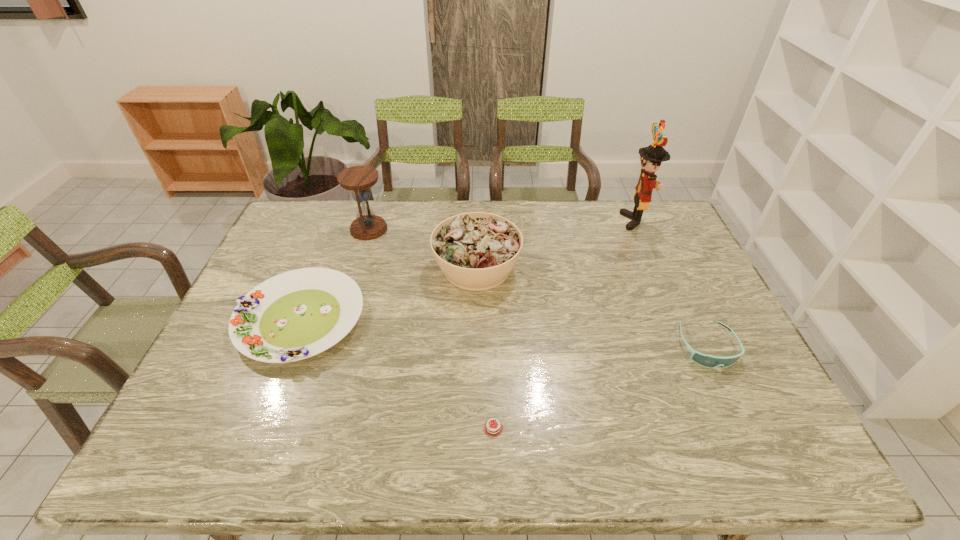
What are the coordinates of `nutcracker` in the screenshot? It's located at (651, 157).

You are a GUI agent. You are given a task and a screenshot of the screen. Output one action in this format:
    pyautogui.click(x=<x>, y=<y>)
    Task: Click on the fifth shortest object
    This screenshot has height=540, width=960.
    Given the screenshot: What is the action you would take?
    pyautogui.click(x=367, y=226)

The image size is (960, 540). I want to click on the fourth shortest object, so click(476, 251).

Identify the location of salad plate. (295, 315).

Where is `goggles`? The width and height of the screenshot is (960, 540). goggles is located at coordinates click(705, 360).

Identify the location of chocolate cake. (492, 428).

In order to click on the shortest object in this screenshot , I will do `click(492, 428)`.

Locate an element on the screen. The image size is (960, 540). vacant position located 0.320m on the front-facing side of the nutcracker is located at coordinates (535, 221).

This screenshot has height=540, width=960. I want to click on vacant space located 0.310m on the front-facing side of the nutcracker, so click(538, 221).

You are a GUI agent. You are given a task and a screenshot of the screen. Output one action in this format:
    pyautogui.click(x=<x>, y=<y>)
    Task: Click on the vacant region located 0.090m on the front-facing side of the nutcracker
    This screenshot has width=960, height=540.
    Given the screenshot: What is the action you would take?
    pyautogui.click(x=598, y=221)